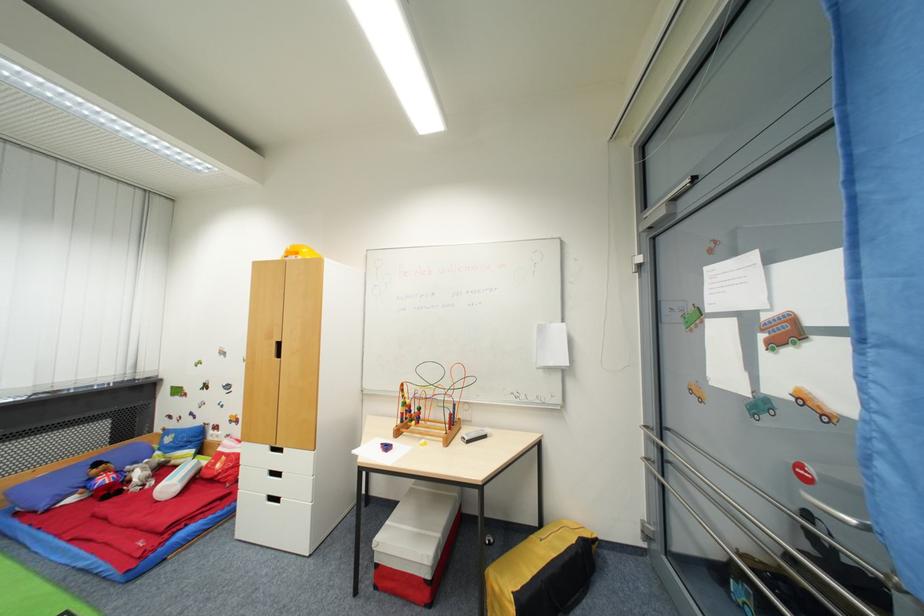
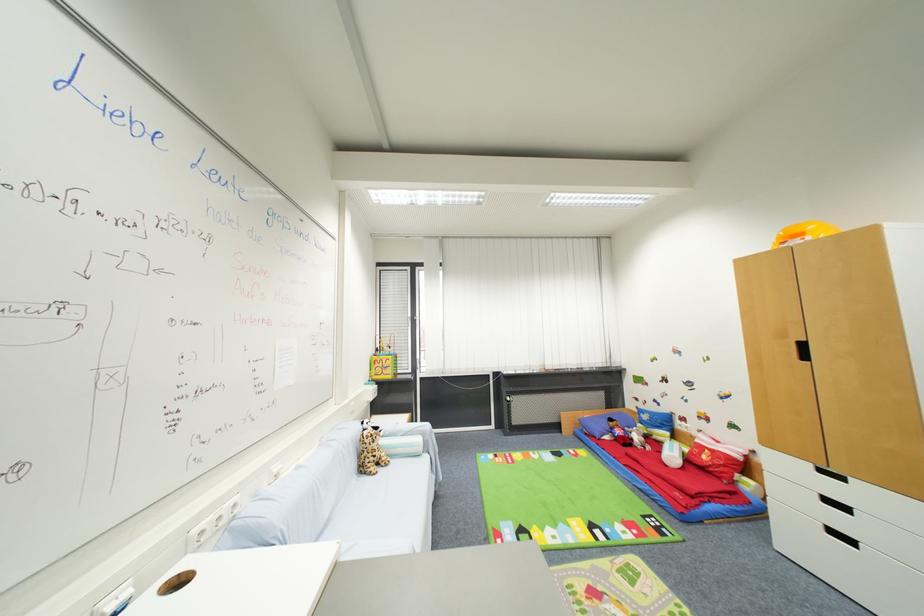
Where in the second image is the point corresponding to point (283, 477) from the first image?

(849, 509)